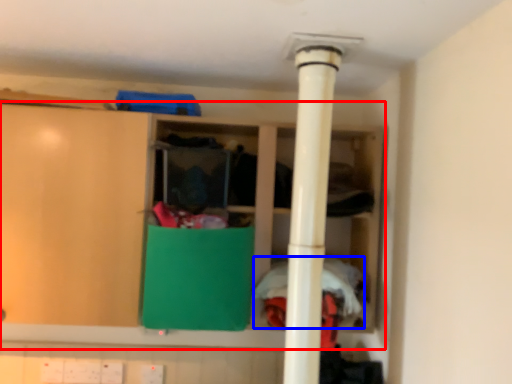
Question: Which object appears closest to the camera in this image, cupboard (highlighted by a red box) or clothing (highlighted by a blue box)?

Choices:
 (A) cupboard
 (B) clothing

Answer: (B)